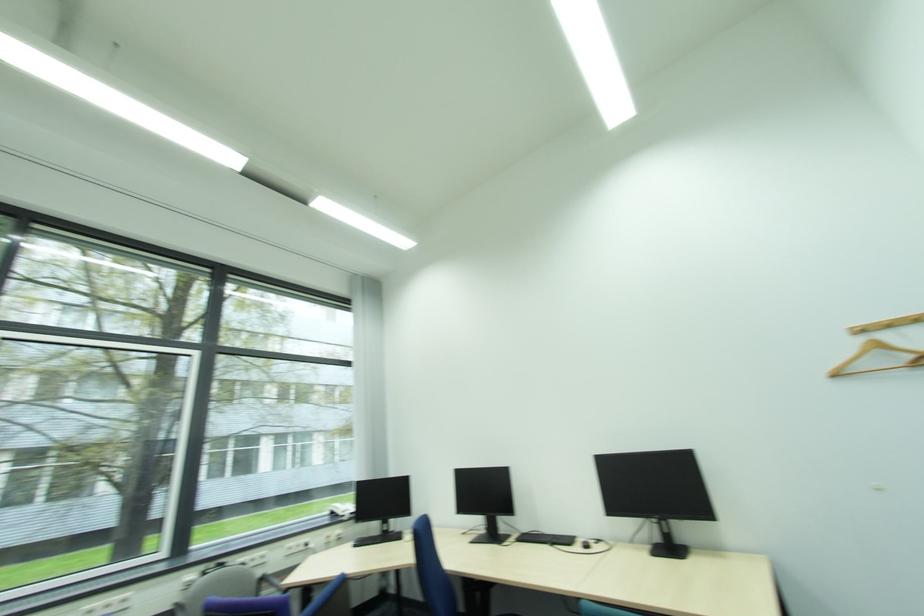
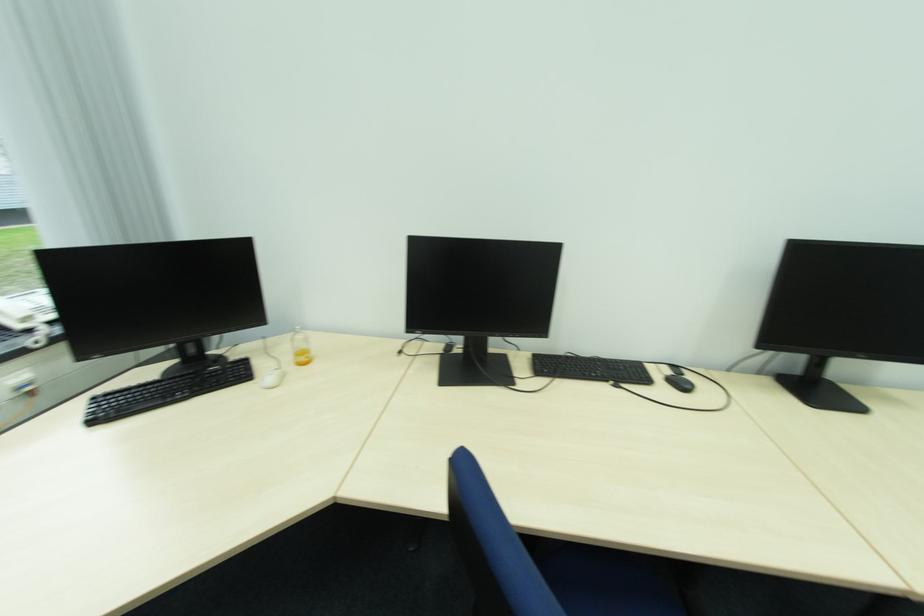
Find the pixel in the second image that matches point 350,512 in the first image.

(31, 320)